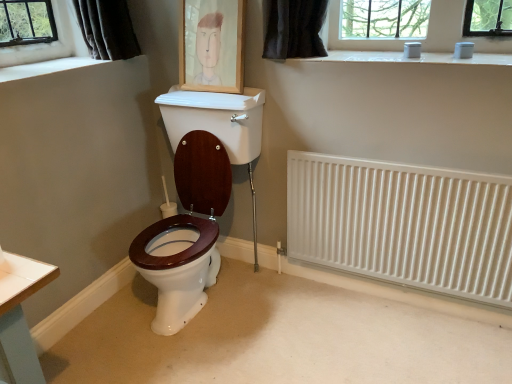
Describe the element at coordinates (46, 68) in the screenshot. I see `white smooth window sill at upper left` at that location.

Describe the element at coordinates (403, 224) in the screenshot. This screenshot has height=384, width=512. I see `white metallic radiator at right` at that location.

Where is `white metallic radiator at right`? The height and width of the screenshot is (384, 512). white metallic radiator at right is located at coordinates (403, 224).

Image resolution: width=512 pixels, height=384 pixels. What do you see at coordinates (211, 45) in the screenshot? I see `wooden picture frame at upper center` at bounding box center [211, 45].

Locate an element on the screen. white smooth window sill at upper left is located at coordinates (46, 68).

Is white metallic radiator at right a part of wooden picture frame at upper center?

No, white metallic radiator at right is not inside wooden picture frame at upper center.

From the image's perspective, is wooden picture frame at upper center below white metallic radiator at right?

Incorrect, from the image's perspective, wooden picture frame at upper center is higher than white metallic radiator at right.

How many degrees apart are the facing directions of wooden picture frame at upper center and white metallic radiator at right?

There is a 0.484-degree angle between the facing directions of wooden picture frame at upper center and white metallic radiator at right.

Considering the sizes of wooden picture frame at upper center and white metallic radiator at right in the image, is wooden picture frame at upper center wider or thinner than white metallic radiator at right?

Considering their sizes, wooden picture frame at upper center looks broader than white metallic radiator at right.

From the image's perspective, would you say white metallic radiator at right is positioned over white smooth window sill at upper left?

No, from the image's perspective, white metallic radiator at right is not on top of white smooth window sill at upper left.

Is white metallic radiator at right looking in the opposite direction of white smooth window sill at upper left?

No, white smooth window sill at upper left is not at the back of white metallic radiator at right.

Considering the sizes of objects white metallic radiator at right and white smooth window sill at upper left in the image provided, who is smaller, white metallic radiator at right or white smooth window sill at upper left?

Smaller between the two is white smooth window sill at upper left.

Would you say white smooth window sill at upper left is a long distance from white metallic radiator at right?

Absolutely, white smooth window sill at upper left is distant from white metallic radiator at right.

Consider the image. Measure the distance from white smooth window sill at upper left to white metallic radiator at right.

4.85 feet.

Where is `window sill on the left of white metallic radiator at right`? This screenshot has width=512, height=384. window sill on the left of white metallic radiator at right is located at coordinates (46, 68).

Is white smooth window sill at upper left bigger than white metallic radiator at right?

Incorrect, white smooth window sill at upper left is not larger than white metallic radiator at right.

Where is `window sill lying below the wooden picture frame at upper center (from the image's perspective)`? window sill lying below the wooden picture frame at upper center (from the image's perspective) is located at coordinates (46, 68).

Does white smooth window sill at upper left touch wooden picture frame at upper center?

white smooth window sill at upper left and wooden picture frame at upper center are not in contact.

Which object is closer to the camera taking this photo, white smooth window sill at upper left or wooden picture frame at upper center?

white smooth window sill at upper left is in front.

From a real-world perspective, does white smooth window sill at upper left sit lower than wooden picture frame at upper center?

Indeed, from a real-world perspective, white smooth window sill at upper left is positioned beneath wooden picture frame at upper center.

From the image's perspective, between wooden picture frame at upper center and white smooth window sill at upper left, who is located below?

white smooth window sill at upper left is shown below in the image.

Could you tell me if wooden picture frame at upper center is turned towards white smooth window sill at upper left?

No, wooden picture frame at upper center is not facing towards white smooth window sill at upper left.

Considering the relative sizes of wooden picture frame at upper center and white smooth window sill at upper left in the image provided, is wooden picture frame at upper center thinner than white smooth window sill at upper left?

Yes, wooden picture frame at upper center is thinner than white smooth window sill at upper left.

How far apart are white metallic radiator at right and wooden picture frame at upper center?

32.60 inches.

Does white metallic radiator at right have a greater width compared to wooden picture frame at upper center?

No.

From a real-world perspective, which is physically above, white metallic radiator at right or wooden picture frame at upper center?

wooden picture frame at upper center, from a real-world perspective.

Considering the sizes of white metallic radiator at right and wooden picture frame at upper center in the image, is white metallic radiator at right taller or shorter than wooden picture frame at upper center?

Clearly, white metallic radiator at right is taller compared to wooden picture frame at upper center.

Locate an element on the screen. Image resolution: width=512 pixels, height=384 pixels. picture frame on the left of white metallic radiator at right is located at coordinates (211, 45).

Locate an element on the screen. window sill above the white metallic radiator at right (from a real-world perspective) is located at coordinates (46, 68).

Looking at the image, which one is located further to white metallic radiator at right, wooden picture frame at upper center or white smooth window sill at upper left?

Based on the image, white smooth window sill at upper left appears to be further to white metallic radiator at right.

Based on their spatial positions, is white metallic radiator at right or wooden picture frame at upper center closer to white smooth window sill at upper left?

The object closer to white smooth window sill at upper left is wooden picture frame at upper center.

Based on their spatial positions, is white metallic radiator at right or white smooth window sill at upper left closer to wooden picture frame at upper center?

The object closer to wooden picture frame at upper center is white smooth window sill at upper left.

Which object lies nearer to the anchor point wooden picture frame at upper center, white smooth window sill at upper left or white metallic radiator at right?

The object closer to wooden picture frame at upper center is white smooth window sill at upper left.

Estimate the real-world distances between objects in this image. Which object is closer to white smooth window sill at upper left, wooden picture frame at upper center or white metallic radiator at right?

Based on the image, wooden picture frame at upper center appears to be nearer to white smooth window sill at upper left.

Based on their spatial positions, is white smooth window sill at upper left or wooden picture frame at upper center closer to white metallic radiator at right?

wooden picture frame at upper center.

You are a GUI agent. You are given a task and a screenshot of the screen. Output one action in this format:
    pyautogui.click(x=<x>, y=<y>)
    Task: Click on the picture frame between white smooth window sill at upper left and white metallic radiator at right in the horizontal direction
    
    Given the screenshot: What is the action you would take?
    pyautogui.click(x=211, y=45)